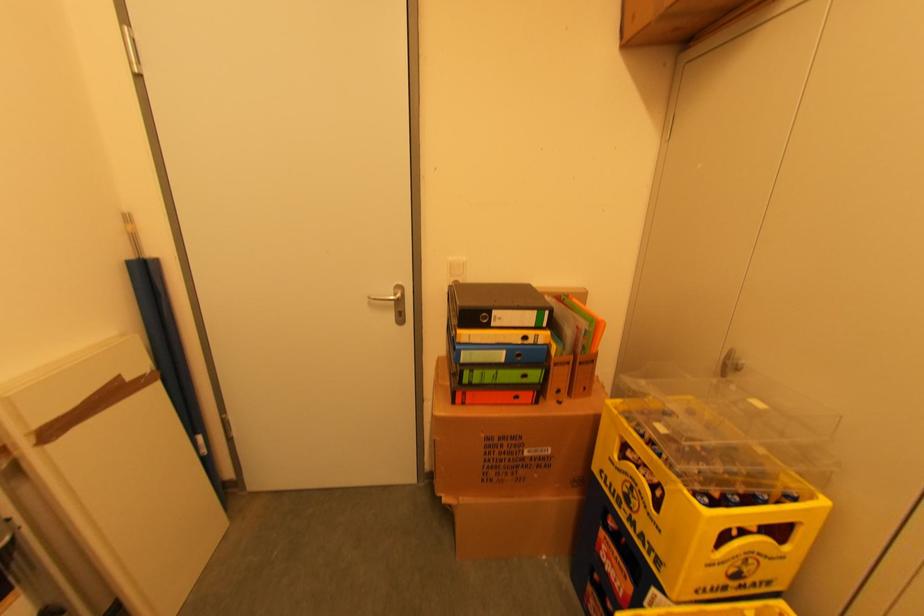
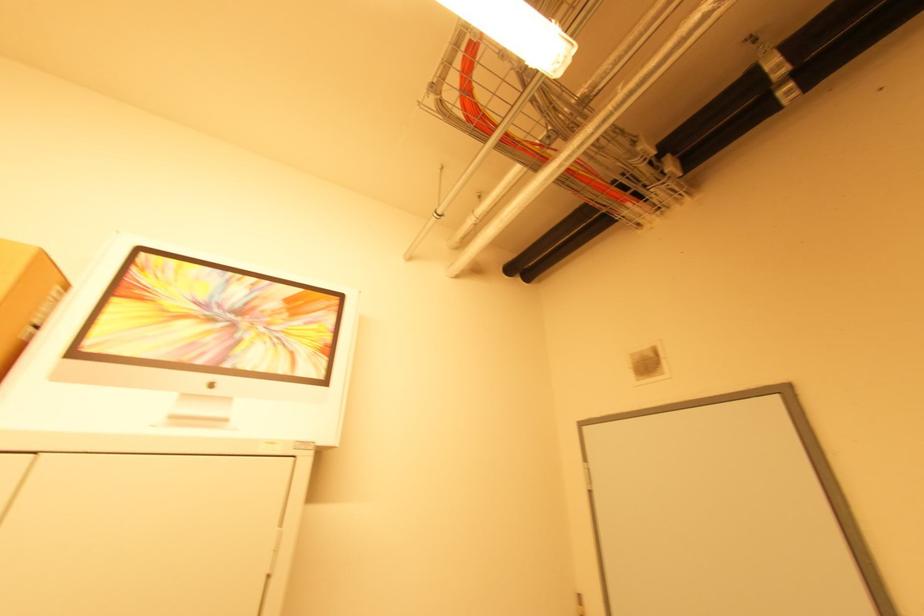
How did the camera likely rotate?

The rotation direction of the camera is left-up.